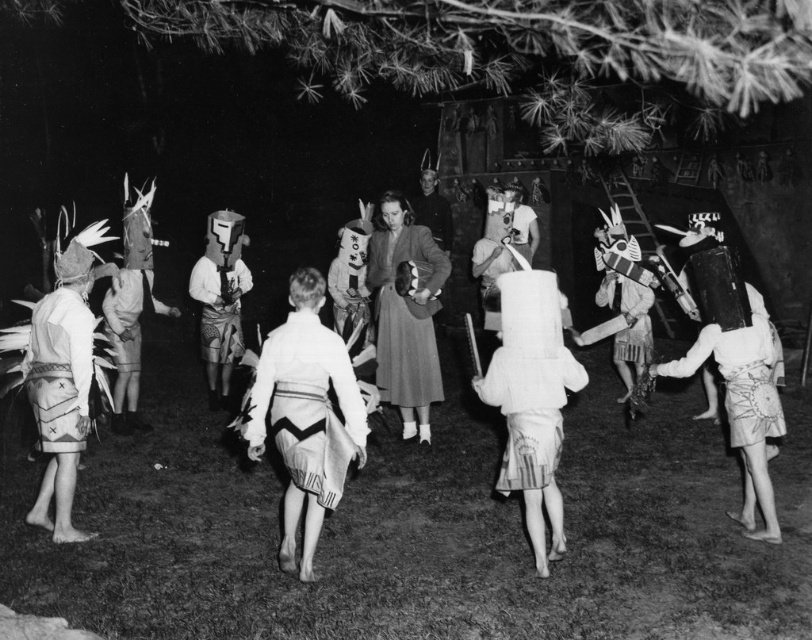
At what (x,y) coordinates should I click in order to perform the action: click on white fabric skirt at lower right. Please return your answer as a coordinate pair (x, y). Looking at the image, I should click on (741, 372).

Which is more to the right, white fabric skirt at lower right or smooth leather jacket at center?

white fabric skirt at lower right

Between point (728, 380) and point (434, 189), which one is positioned in front?

Point (728, 380) is in front.

Where is `white fabric skirt at lower right`? white fabric skirt at lower right is located at coordinates (741, 372).

Can you confirm if matte gray coat at center is positioned below white fabric skirt at lower right?

Actually, matte gray coat at center is above white fabric skirt at lower right.

Can you confirm if matte gray coat at center is positioned to the left of white fabric skirt at lower right?

Yes, matte gray coat at center is to the left of white fabric skirt at lower right.

Between point (422, 248) and point (754, 371), which one is positioned behind?

Point (422, 248)

Find the location of a particular element. The height and width of the screenshot is (640, 812). matte gray coat at center is located at coordinates (406, 314).

Does white cotton skirt at center appear over smooth leather jacket at center?

No, white cotton skirt at center is not above smooth leather jacket at center.

Can you confirm if white cotton skirt at center is wider than smooth leather jacket at center?

Yes.

What do you see at coordinates (307, 404) in the screenshot? I see `white cotton skirt at center` at bounding box center [307, 404].

This screenshot has width=812, height=640. In order to click on white cotton skirt at center in this screenshot , I will do `click(307, 404)`.